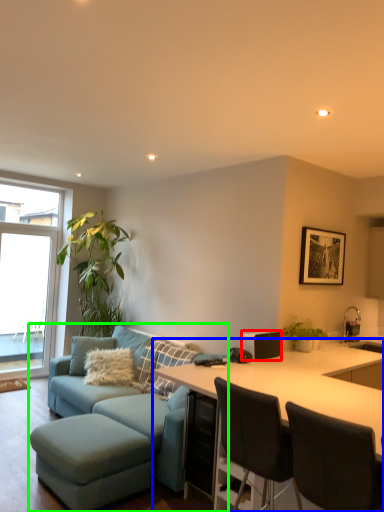
Question: Based on their relative distances, which object is farther from appliance (highlighted by a red box)? Choose from desk (highlighted by a blue box) and studio couch (highlighted by a green box).

Choices:
 (A) desk
 (B) studio couch

Answer: (B)